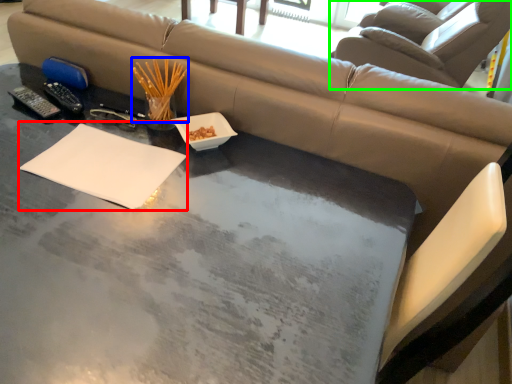
Question: Estimate the real-world distances between objects in this image. Which object is farther from notepad (highlighted by a red box), chopstick (highlighted by a blue box) or swivel chair (highlighted by a green box)?

Choices:
 (A) chopstick
 (B) swivel chair

Answer: (B)